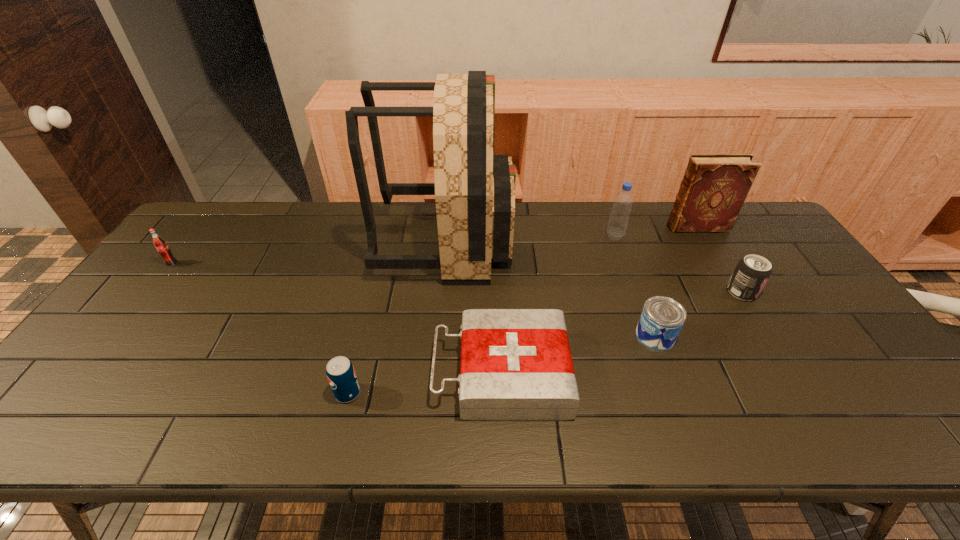
This screenshot has width=960, height=540. Find the location of `vacant region located 0.160m on the front side of the first-aid kit`. vacant region located 0.160m on the front side of the first-aid kit is located at coordinates (368, 373).

Find the location of a particular element. vacant space located on the front side of the first-aid kit is located at coordinates (393, 373).

At what (x,y) coordinates should I click in order to perform the action: click on vacant space located 0.380m on the front side of the first-aid kit. Please return your answer as a coordinate pair (x, y). Looking at the image, I should click on (276, 373).

This screenshot has width=960, height=540. In order to click on backpack present at the far edge in this screenshot , I will do `click(474, 189)`.

I want to click on hardback book located in the far edge section of the desktop, so click(x=714, y=187).

Where is `bottle present at the far edge`? bottle present at the far edge is located at coordinates (617, 225).

At what (x,y) coordinates should I click in order to perform the action: click on object that is at the near edge. Please return your answer as a coordinate pair (x, y). Looking at the image, I should click on (516, 365).

Find the location of `object that is at the left edge`. object that is at the left edge is located at coordinates coord(159,243).

The width and height of the screenshot is (960, 540). Identify the location of object situated at the right edge. (714, 187).

Identify the location of object present at the far right corner. pos(714,187).